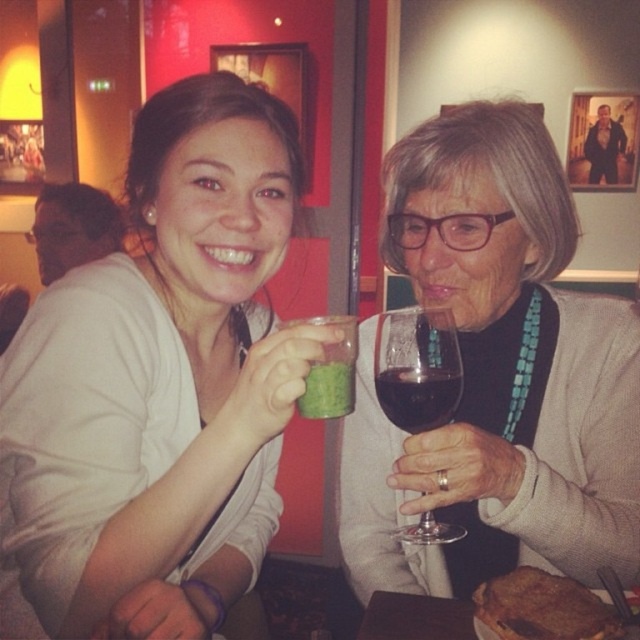
In the scene shown: Which is below, matte black wine glass at center or brown crispy bread at lower right?

brown crispy bread at lower right is lower down.

Can you confirm if matte black wine glass at center is thinner than brown crispy bread at lower right?

No.

Who is more forward, (532, 488) or (493, 630)?

Point (493, 630) is in front.

Identify the location of matte black wine glass at center. The height and width of the screenshot is (640, 640). (497, 374).

Between transparent glass at upper right and green matte cup at center, which one has more height?

Standing taller between the two is transparent glass at upper right.

Does transparent glass at upper right have a larger size compared to green matte cup at center?

Indeed, transparent glass at upper right has a larger size compared to green matte cup at center.

Locate an element on the screen. transparent glass at upper right is located at coordinates pyautogui.click(x=417, y=368).

Identify the location of transparent glass at upper right. This screenshot has height=640, width=640. (417, 368).

Who is shorter, transparent glass at upper right or brown crispy bread at lower right?

With less height is brown crispy bread at lower right.

Between transparent glass at upper right and brown crispy bread at lower right, which one appears on the right side from the viewer's perspective?

brown crispy bread at lower right

This screenshot has height=640, width=640. What do you see at coordinates (417, 368) in the screenshot?
I see `transparent glass at upper right` at bounding box center [417, 368].

Find the location of a particular element. This screenshot has width=640, height=640. transparent glass at upper right is located at coordinates point(417,368).